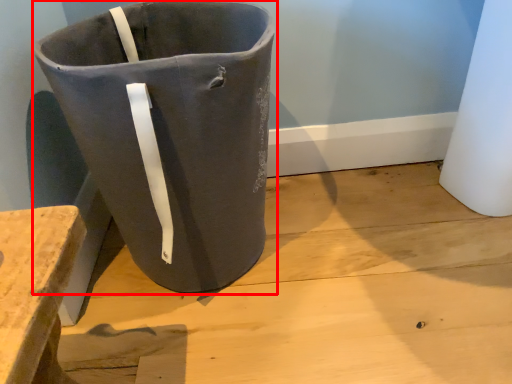
Question: From the image, what is the correct spatial relationship of waste container (annotated by the red box) in relation to concrete?

Choices:
 (A) right
 (B) left

Answer: (B)